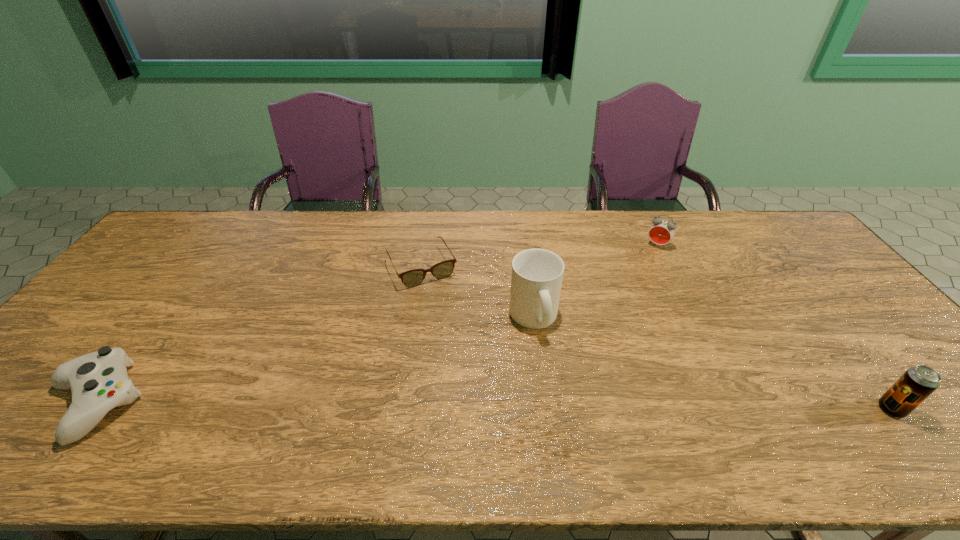
Where is `spectacles located in the far edge section of the desktop`? This screenshot has width=960, height=540. spectacles located in the far edge section of the desktop is located at coordinates (412, 278).

Locate an element on the screen. The height and width of the screenshot is (540, 960). control located at the near edge is located at coordinates (98, 381).

Locate an element on the screen. The image size is (960, 540). beer can that is positioned at the near edge is located at coordinates (918, 382).

In order to click on object that is positioned at the left edge in this screenshot , I will do `click(98, 381)`.

Where is `object present at the right edge`? The width and height of the screenshot is (960, 540). object present at the right edge is located at coordinates (918, 382).

At what (x,y) coordinates should I click in order to perform the action: click on object that is at the near left corner. Please return your answer as a coordinate pair (x, y). Looking at the image, I should click on (98, 381).

Identify the location of object situated at the near right corner. The width and height of the screenshot is (960, 540). pos(918,382).

I want to click on vacant region at the far edge of the desktop, so click(x=365, y=231).

Image resolution: width=960 pixels, height=540 pixels. I want to click on vacant position at the near edge of the desktop, so click(x=377, y=397).

Where is `vacant space at the left edge of the desktop`? vacant space at the left edge of the desktop is located at coordinates (55, 354).